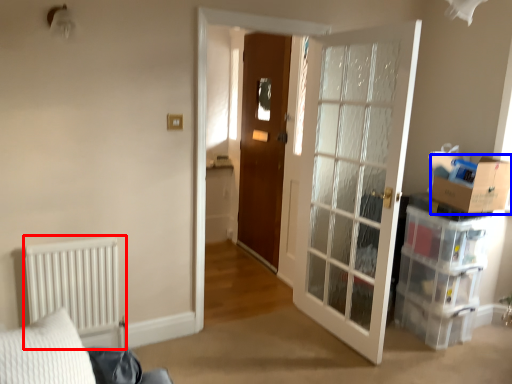
Question: Which object is closer to the camera taking this photo, radiator (highlighted by a red box) or cardboard box (highlighted by a blue box)?

Choices:
 (A) radiator
 (B) cardboard box

Answer: (A)